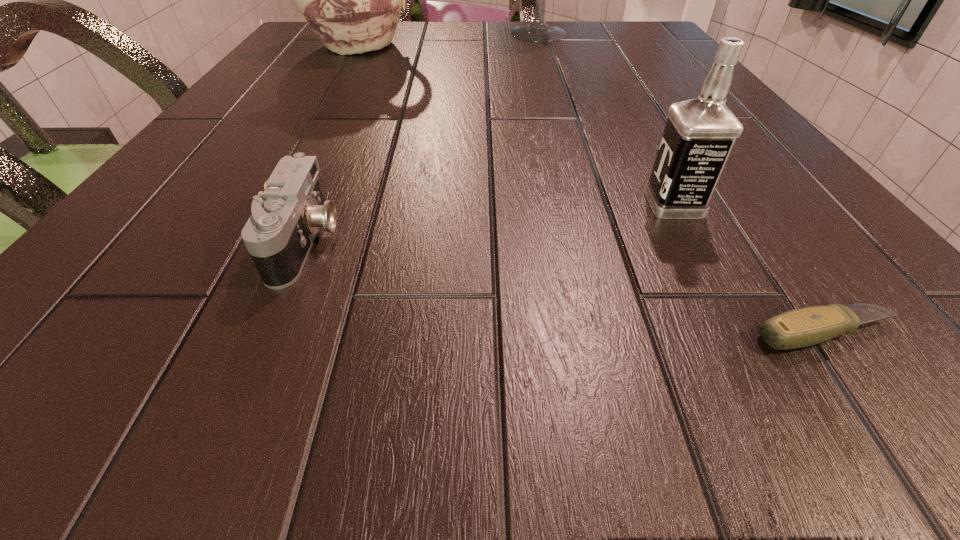
Find the location of a particular element. object at the near right corner is located at coordinates (802, 327).

You are a GUI agent. You are given a task and a screenshot of the screen. Output one action in this format:
    pyautogui.click(x=<x>, y=<y>)
    Task: Click on the vacant space at the far edge of the desktop
    This screenshot has height=540, width=960.
    Given the screenshot: What is the action you would take?
    pyautogui.click(x=444, y=45)

Identify the location of vacant space at the left edge. (278, 64).

At what (x,y) coordinates should I click in order to perform the action: click on vacant space at the right edge of the desktop. Please return your answer as a coordinate pair (x, y). Looking at the image, I should click on (885, 278).

I want to click on unoccupied position between the pitcher and the vodka, so click(x=519, y=125).

Locate an element on the screen. The width and height of the screenshot is (960, 540). free spot between the fourth tallest object and the pitcher is located at coordinates (335, 143).

The image size is (960, 540). In order to click on free space between the fourth tallest object and the vodka in this screenshot , I will do `click(490, 222)`.

Where is `free space between the camera and the vodka`? The height and width of the screenshot is (540, 960). free space between the camera and the vodka is located at coordinates (490, 222).

Locate an element on the screen. vacant point located between the nearest object and the fourth tallest object is located at coordinates (565, 287).

Where is `empty location between the camera and the pocketknife`? empty location between the camera and the pocketknife is located at coordinates (565, 287).